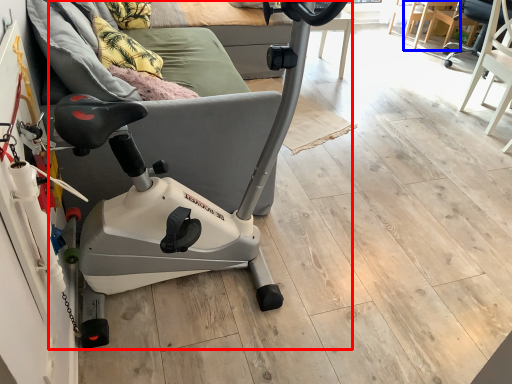
Question: Which object is further to the camera taking this photo, stationary bicycle (highlighted by a red box) or table (highlighted by a blue box)?

Choices:
 (A) stationary bicycle
 (B) table

Answer: (B)